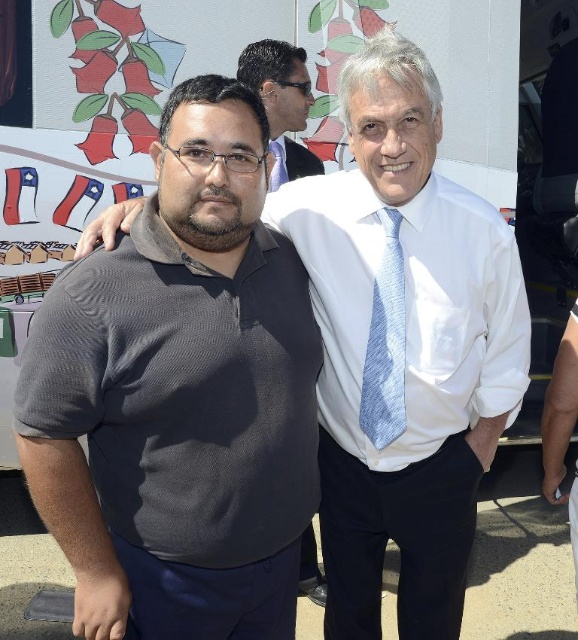
Consider the image. Who is more forward, (42, 483) or (280, 81)?

Point (42, 483) is more forward.

Find the location of a particular element. dark gray knit polo shirt at left is located at coordinates coord(180,396).

Who is taller, dark gray knit polo shirt at left or blue textured tie at center?

With more height is dark gray knit polo shirt at left.

Does dark gray knit polo shirt at left have a greater height compared to blue textured tie at center?

Indeed, dark gray knit polo shirt at left has a greater height compared to blue textured tie at center.

The width and height of the screenshot is (578, 640). What are the coordinates of `dark gray knit polo shirt at left` in the screenshot? It's located at (180, 396).

Identify the location of dark gray knit polo shirt at left. The height and width of the screenshot is (640, 578). (180, 396).

Which of these two, matte black shirt at upper center or blue textured tie at center, stands shorter?

With less height is blue textured tie at center.

Between matte black shirt at upper center and blue textured tie at center, which one appears on the left side from the viewer's perspective?

Positioned to the left is blue textured tie at center.

Does point (264, 51) come closer to viewer compared to point (272, 164)?

No, (264, 51) is further to viewer.

The width and height of the screenshot is (578, 640). I want to click on matte black shirt at upper center, so click(x=281, y=104).